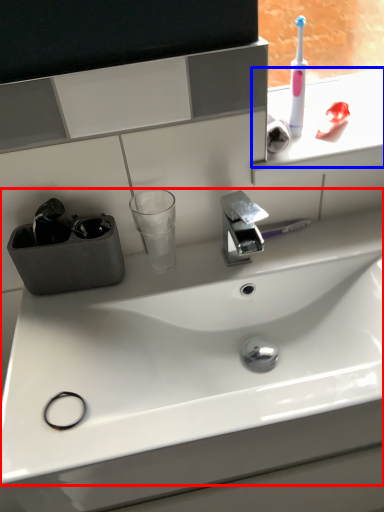
Question: Among these objects, which one is nearest to the camera, sink (highlighted by a red box) or window sill (highlighted by a blue box)?

Choices:
 (A) sink
 (B) window sill

Answer: (A)